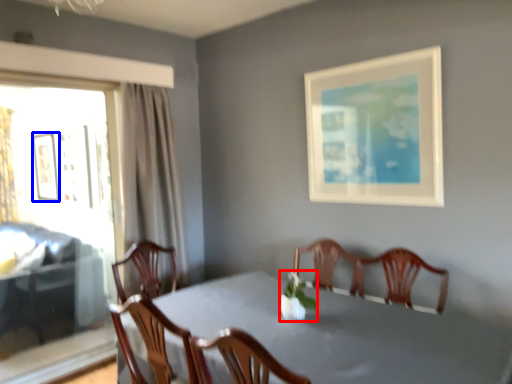
Question: Which object appears closest to the camera in this image, floral arrangement (highlighted by a red box) or picture frame (highlighted by a blue box)?

Choices:
 (A) floral arrangement
 (B) picture frame

Answer: (A)